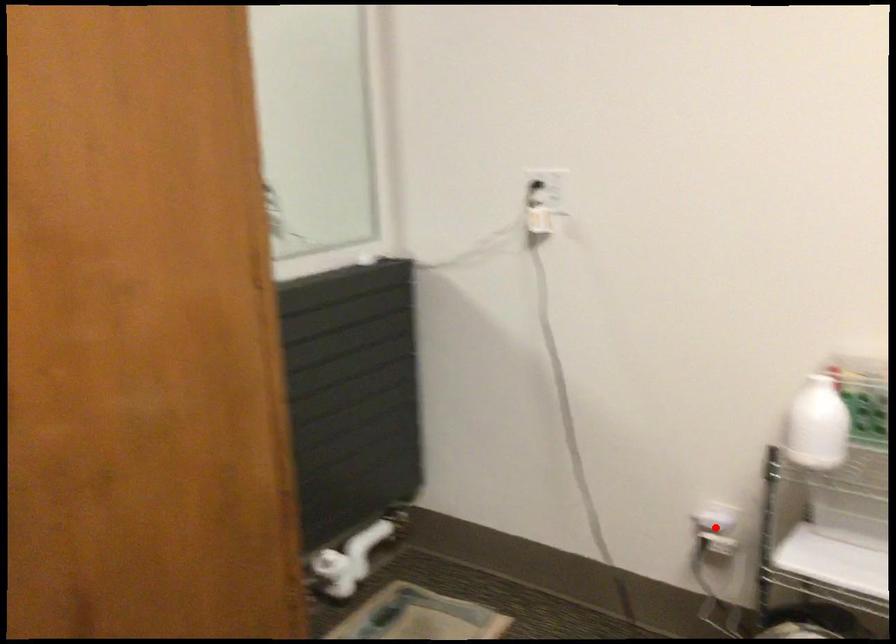
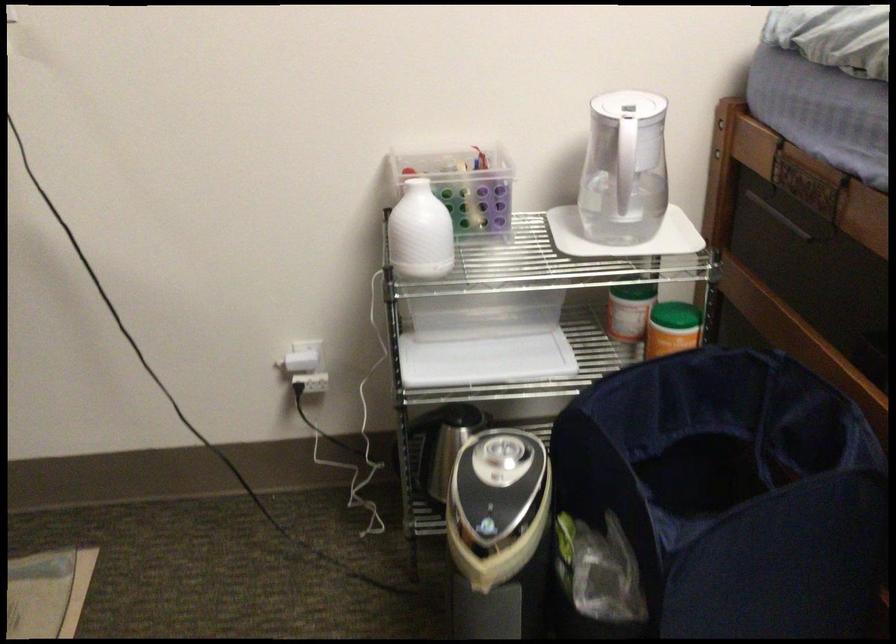
Question: I am providing you with two images of the same scene from different viewpoints. A red point is shown in image1. For the corresponding object point in image2, is it positioned nearer or farther from the camera?

Choices:
 (A) Nearer
 (B) Farther

Answer: (A)